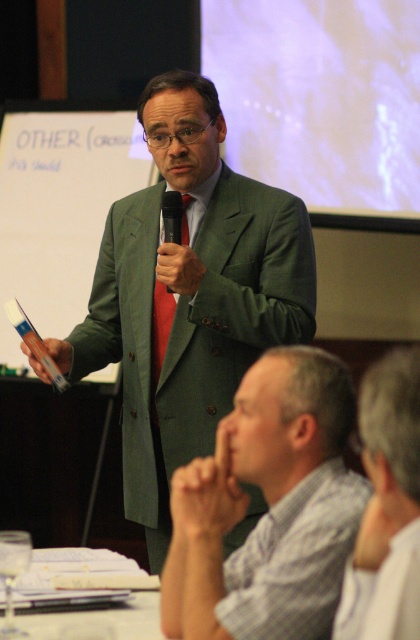
Question: Which object is farther from the camera taking this photo?

Choices:
 (A) gray striped shirt at lower center
 (B) green wool suit at center
 (C) red satin tie at center

Answer: (C)

Question: Which point is farther to the camera?

Choices:
 (A) green wool suit at center
 (B) gray fabric shirt at lower right

Answer: (A)

Question: Can you confirm if gray fabric shirt at lower right is positioned above black matte microphone at center?

Choices:
 (A) no
 (B) yes

Answer: (A)

Question: Which point is closer to the camera taking this photo?

Choices:
 (A) (176, 230)
 (B) (110, 216)
 (C) (280, 548)

Answer: (C)

Question: Can you confirm if red satin tie at center is positioned above black matte microphone at center?

Choices:
 (A) yes
 (B) no

Answer: (B)

Question: Is gray striped shirt at lower center thinner than black matte microphone at center?

Choices:
 (A) no
 (B) yes

Answer: (A)